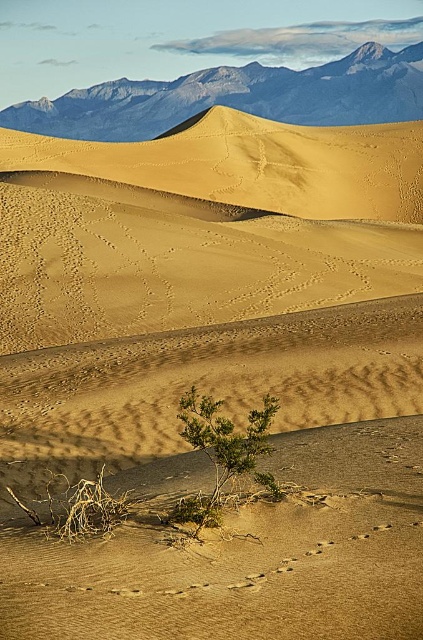
Can you confirm if sandy yellow dune at upper center is shorter than green leafy shrub at center?

No, sandy yellow dune at upper center is not shorter than green leafy shrub at center.

Image resolution: width=423 pixels, height=640 pixels. What are the coordinates of `sandy yellow dune at upper center` in the screenshot? It's located at (252, 164).

This screenshot has height=640, width=423. Find the location of `sandy yellow dune at upper center`. sandy yellow dune at upper center is located at coordinates (252, 164).

Is rocky gray mountain range at upper center positioned before green leafy shrub at center?

No, rocky gray mountain range at upper center is further to the viewer.

This screenshot has width=423, height=640. What are the coordinates of `rocky gray mountain range at upper center` in the screenshot? It's located at (236, 97).

Between sandy yellow dune at upper center and rocky gray mountain range at upper center, which one appears on the left side from the viewer's perspective?

rocky gray mountain range at upper center is more to the left.

Does sandy yellow dune at upper center have a greater width compared to rocky gray mountain range at upper center?

In fact, sandy yellow dune at upper center might be narrower than rocky gray mountain range at upper center.

Looking at this image, who is more distant from viewer, (118, 163) or (247, 68)?

The point (247, 68) is behind.

Image resolution: width=423 pixels, height=640 pixels. Identify the location of sandy yellow dune at upper center. (252, 164).